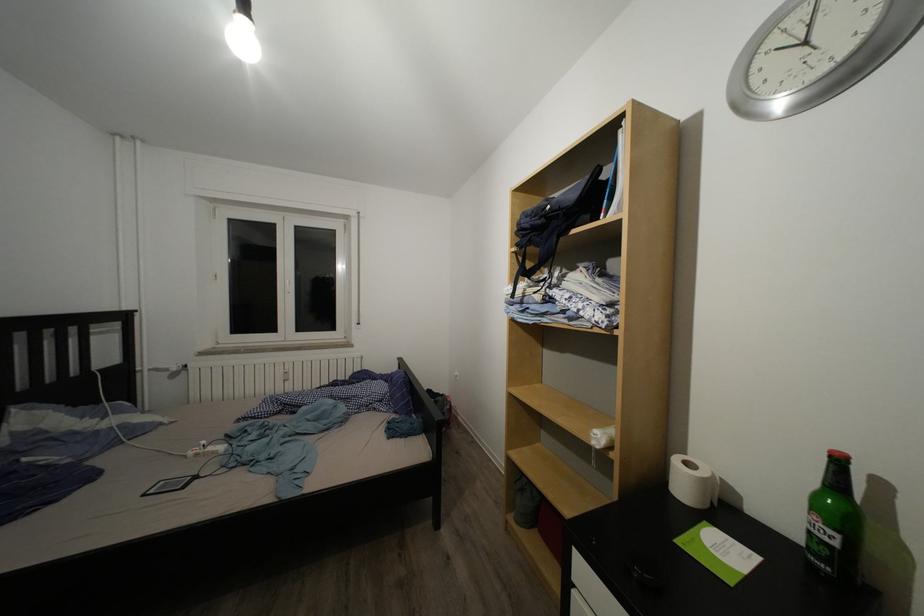
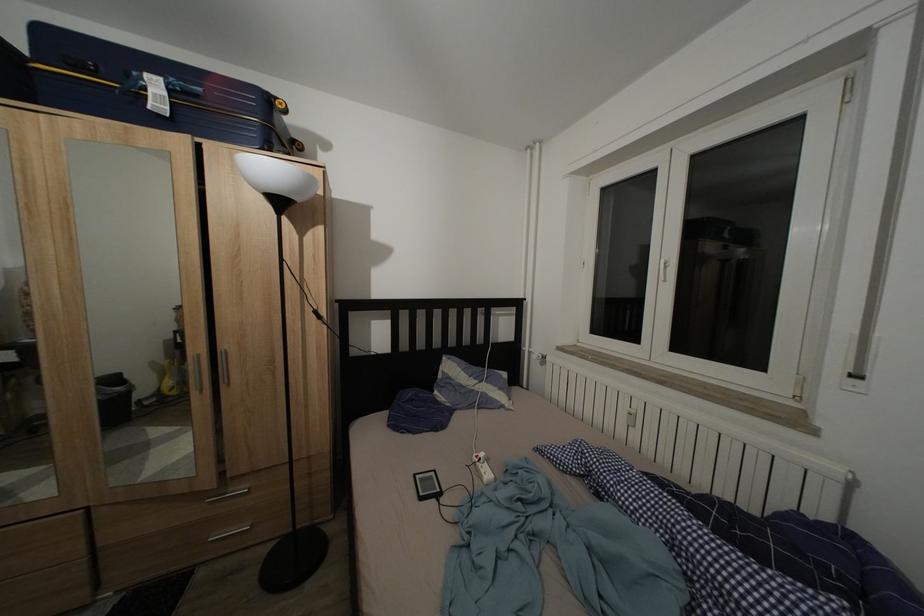
The point at (222, 459) is marked in the first image. Where is the corresponding point in the second image?

(488, 483)